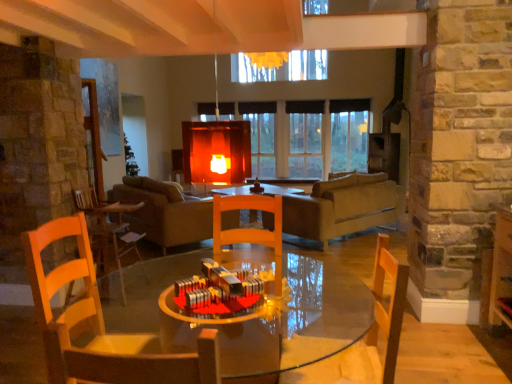
Question: Is wooden chair at left, the first chair viewed from the back, facing away from transparent glass window at center?

Choices:
 (A) no
 (B) yes

Answer: (A)

Question: From a real-world perspective, is wooden chair at left, acting as the 1th chair starting from the left, physically above transparent glass window at center?

Choices:
 (A) no
 (B) yes

Answer: (A)

Question: Can you confirm if wooden chair at left, acting as the 1th chair starting from the left, is smaller than transparent glass window at center?

Choices:
 (A) yes
 (B) no

Answer: (A)

Question: Is wooden chair at left, which is the 3th chair in front-to-back order, at the left side of transparent glass window at center?

Choices:
 (A) yes
 (B) no

Answer: (A)

Question: Could transparent glass window at center be considered to be inside wooden chair at left, acting as the 1th chair starting from the left?

Choices:
 (A) yes
 (B) no

Answer: (B)

Question: Is transparent glass window at center to the left or to the right of wooden chair at center, which appears as the 2th chair when viewed from the front, in the image?

Choices:
 (A) left
 (B) right

Answer: (B)

Question: Is transparent glass window at center in front of or behind wooden chair at center, acting as the second chair starting from the back, in the image?

Choices:
 (A) front
 (B) behind

Answer: (B)

Question: Which is correct: transparent glass window at center is inside wooden chair at center, acting as the second chair starting from the back, or outside of it?

Choices:
 (A) inside
 (B) outside

Answer: (B)

Question: Looking at their shapes, would you say transparent glass window at center is wider or thinner than wooden chair at center, acting as the second chair starting from the back?

Choices:
 (A) thin
 (B) wide

Answer: (A)

Question: Considering the positions of leather couch at center and wooden chair at left, which is the 3th chair in front-to-back order, in the image, is leather couch at center taller or shorter than wooden chair at left, which is the 3th chair in front-to-back order,?

Choices:
 (A) tall
 (B) short

Answer: (B)

Question: Based on their sizes in the image, would you say leather couch at center is bigger or smaller than wooden chair at left, the first chair viewed from the back?

Choices:
 (A) big
 (B) small

Answer: (A)

Question: From a real-world perspective, is leather couch at center above or below wooden chair at left, which is the 3th chair in front-to-back order?

Choices:
 (A) below
 (B) above

Answer: (A)

Question: From the image's perspective, is leather couch at center located above or below wooden chair at left, arranged as the third chair when viewed from the right?

Choices:
 (A) above
 (B) below

Answer: (A)

Question: Considering their positions, is transparent glass window at center located in front of or behind matte gray couch at center?

Choices:
 (A) front
 (B) behind

Answer: (B)

Question: From a real-world perspective, is transparent glass window at center above or below matte gray couch at center?

Choices:
 (A) above
 (B) below

Answer: (A)